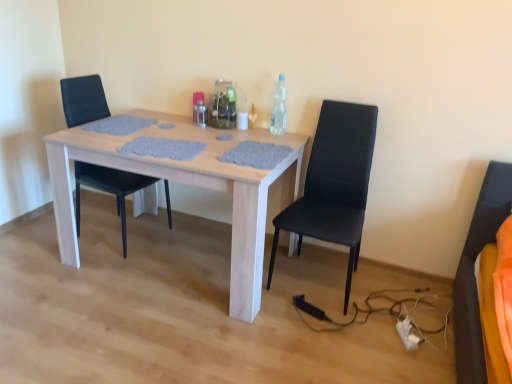
Question: Considering the relative sizes of black leather chair at right, which is counted as the 1th chair, starting from the right, and white fabric extension cord at lower right in the image provided, is black leather chair at right, which is counted as the 1th chair, starting from the right, smaller than white fabric extension cord at lower right?

Choices:
 (A) yes
 (B) no

Answer: (B)

Question: Is black leather chair at right, which is counted as the 1th chair, starting from the right, next to white fabric extension cord at lower right?

Choices:
 (A) yes
 (B) no

Answer: (B)

Question: Does black leather chair at right, which is counted as the 1th chair, starting from the right, have a lesser height compared to white fabric extension cord at lower right?

Choices:
 (A) no
 (B) yes

Answer: (A)

Question: Considering the relative sizes of black leather chair at right, arranged as the second chair when viewed from the left, and white fabric extension cord at lower right in the image provided, is black leather chair at right, arranged as the second chair when viewed from the left, wider than white fabric extension cord at lower right?

Choices:
 (A) no
 (B) yes

Answer: (B)

Question: From a real-world perspective, does black leather chair at right, which is counted as the 1th chair, starting from the right, stand above white fabric extension cord at lower right?

Choices:
 (A) yes
 (B) no

Answer: (A)

Question: Is point (201, 109) closer or farther from the camera than point (122, 213)?

Choices:
 (A) closer
 (B) farther

Answer: (A)

Question: Considering their positions, is metallic silver bottle at center, which is counted as the 3th bottle, starting from the right, located in front of or behind black leather chair at center, marked as the second chair in a right-to-left arrangement?

Choices:
 (A) front
 (B) behind

Answer: (B)

Question: Is metallic silver bottle at center, arranged as the first bottle when viewed from the left, wider or thinner than black leather chair at center, marked as the second chair in a right-to-left arrangement?

Choices:
 (A) wide
 (B) thin

Answer: (B)

Question: Is metallic silver bottle at center, arranged as the first bottle when viewed from the left, situated inside black leather chair at center, marked as the second chair in a right-to-left arrangement, or outside?

Choices:
 (A) outside
 (B) inside

Answer: (A)

Question: Considering the positions of metallic silver bottle at center, arranged as the first bottle when viewed from the left, and white fabric extension cord at lower right in the image, is metallic silver bottle at center, arranged as the first bottle when viewed from the left, taller or shorter than white fabric extension cord at lower right?

Choices:
 (A) tall
 (B) short

Answer: (A)

Question: In the image, is metallic silver bottle at center, which is counted as the 3th bottle, starting from the right, on the left side or the right side of white fabric extension cord at lower right?

Choices:
 (A) left
 (B) right

Answer: (A)

Question: Considering their positions, is metallic silver bottle at center, which is counted as the 3th bottle, starting from the right, located in front of or behind white fabric extension cord at lower right?

Choices:
 (A) front
 (B) behind

Answer: (B)

Question: Considering the positions of point (201, 104) and point (412, 347), is point (201, 104) closer or farther from the camera than point (412, 347)?

Choices:
 (A) closer
 (B) farther

Answer: (B)

Question: Visually, is clear plastic bottle at upper right, placed as the 1th bottle when sorted from right to left, positioned to the left or to the right of black leather chair at center, the 1th chair viewed from the left?

Choices:
 (A) right
 (B) left

Answer: (A)

Question: From a real-world perspective, relative to black leather chair at center, marked as the second chair in a right-to-left arrangement, is clear plastic bottle at upper right, placed as the 1th bottle when sorted from right to left, vertically above or below?

Choices:
 (A) below
 (B) above

Answer: (B)